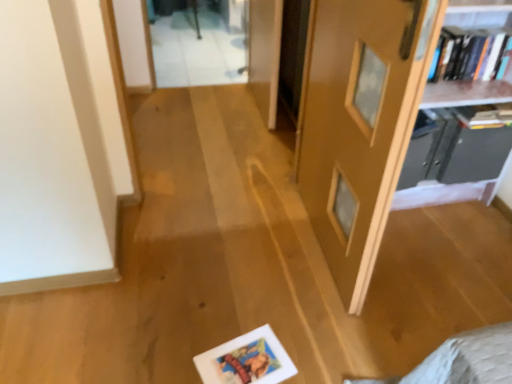
Question: From the image's perspective, is white matte picture frame at lower center above matte wooden door at center?

Choices:
 (A) yes
 (B) no

Answer: (B)

Question: Is matte wooden door at center surrounded by white matte picture frame at lower center?

Choices:
 (A) yes
 (B) no

Answer: (B)

Question: Is white matte picture frame at lower center not near matte wooden door at center?

Choices:
 (A) yes
 (B) no

Answer: (B)

Question: Is white matte picture frame at lower center with matte wooden door at center?

Choices:
 (A) yes
 (B) no

Answer: (B)

Question: From a real-world perspective, is white matte picture frame at lower center on top of matte wooden door at center?

Choices:
 (A) yes
 (B) no

Answer: (B)

Question: From the image's perspective, relative to wooden bookshelf at upper right, arranged as the first shelf when viewed from the top, is black plastic shelf at upper right, marked as the 1th shelf in a bottom-to-top arrangement, above or below?

Choices:
 (A) below
 (B) above

Answer: (A)

Question: In terms of height, does black plastic shelf at upper right, which ranks as the second shelf in top-to-bottom order, look taller or shorter compared to wooden bookshelf at upper right, which appears as the 2th shelf when ordered from the bottom?

Choices:
 (A) tall
 (B) short

Answer: (B)

Question: Do you think black plastic shelf at upper right, marked as the 1th shelf in a bottom-to-top arrangement, is within wooden bookshelf at upper right, arranged as the first shelf when viewed from the top, or outside of it?

Choices:
 (A) inside
 (B) outside

Answer: (A)

Question: Is black plastic shelf at upper right, marked as the 1th shelf in a bottom-to-top arrangement, wider or thinner than wooden bookshelf at upper right, arranged as the first shelf when viewed from the top?

Choices:
 (A) thin
 (B) wide

Answer: (B)

Question: From the image's perspective, is hardcover books at upper right, which is the second book from bottom to top, located above or below hardcover book at upper right, the first book from the bottom?

Choices:
 (A) above
 (B) below

Answer: (A)

Question: Is hardcover books at upper right, which ranks as the 1th book in top-to-bottom order, to the left or to the right of hardcover book at upper right, the first book from the bottom, in the image?

Choices:
 (A) right
 (B) left

Answer: (B)

Question: Considering the positions of hardcover books at upper right, which is the second book from bottom to top, and hardcover book at upper right, which is the second book in top-to-bottom order, in the image, is hardcover books at upper right, which is the second book from bottom to top, taller or shorter than hardcover book at upper right, which is the second book in top-to-bottom order,?

Choices:
 (A) tall
 (B) short

Answer: (A)

Question: Based on their sizes in the image, would you say hardcover books at upper right, which is the second book from bottom to top, is bigger or smaller than hardcover book at upper right, the first book from the bottom?

Choices:
 (A) small
 (B) big

Answer: (B)

Question: Does point (462, 134) appear closer or farther from the camera than point (254, 340)?

Choices:
 (A) farther
 (B) closer

Answer: (A)

Question: Is black plastic shelf at upper right, marked as the 1th shelf in a bottom-to-top arrangement, wider or thinner than white matte picture frame at lower center?

Choices:
 (A) thin
 (B) wide

Answer: (B)